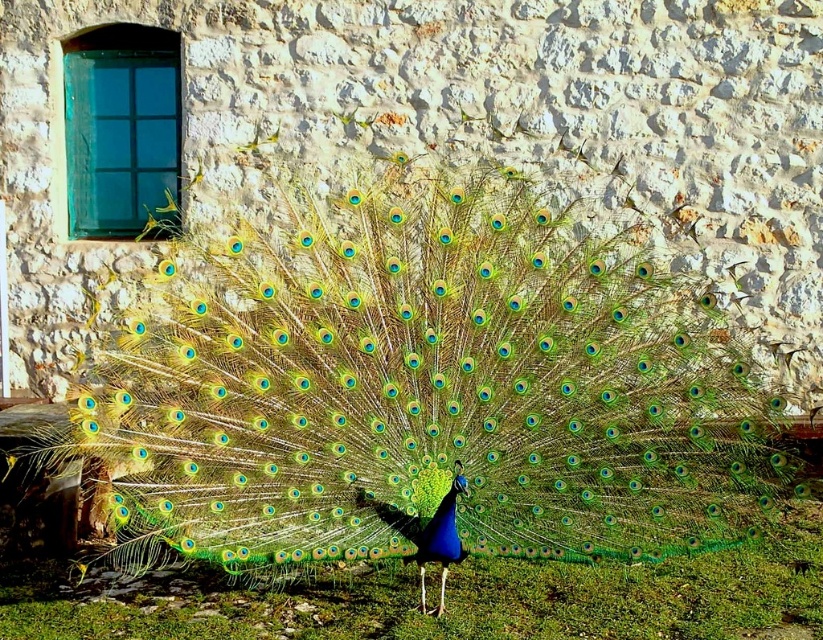
Is point (408, 310) behind point (524, 625)?

No, it is not.

Is point (568, 360) positioned in front of point (491, 593)?

Yes, it is in front of point (491, 593).

Where is `green iridescent peacock at center`? green iridescent peacock at center is located at coordinates (426, 387).